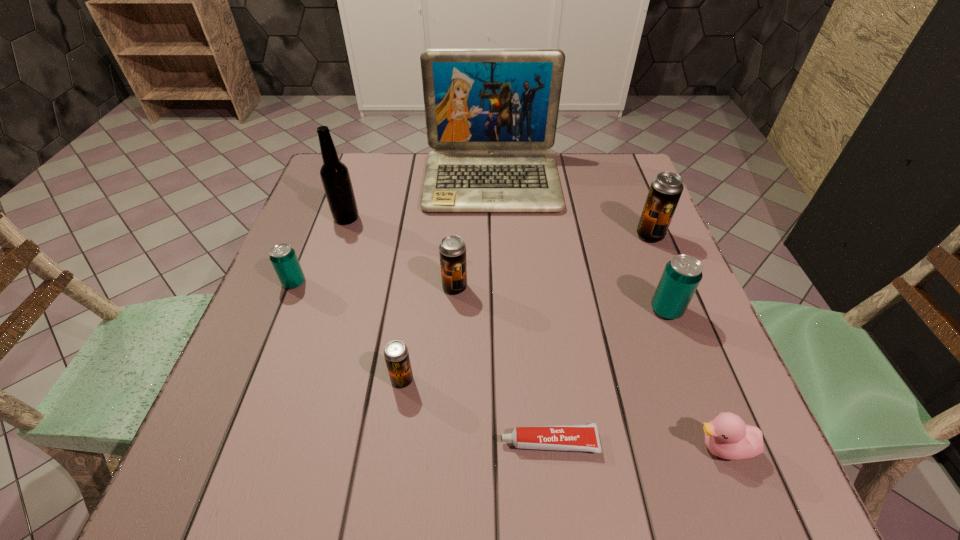
Where is `free region located on the back of the sixth farthest object`? free region located on the back of the sixth farthest object is located at coordinates (631, 216).

This screenshot has width=960, height=540. Find the location of `vacant space located on the back of the left teal beer can`. vacant space located on the back of the left teal beer can is located at coordinates (313, 237).

You are a GUI agent. You are given a task and a screenshot of the screen. Output one action in this format:
    pyautogui.click(x=<x>, y=<y>)
    Task: Click on the free space located on the left of the smallest black beer can
    This screenshot has width=960, height=540.
    Given the screenshot: What is the action you would take?
    pyautogui.click(x=260, y=380)

Where is `free space located on the front-facing side of the second shortest object`? free space located on the front-facing side of the second shortest object is located at coordinates (575, 448).

Identify the location of free location located 0.090m on the front-facing side of the second shortest object. The width and height of the screenshot is (960, 540). (636, 448).

Identify the location of vacant region located 0.280m on the front-facing side of the second shortest object. This screenshot has width=960, height=540. (520, 448).

Where is `vacant space located 0.390m at the nozzle of the shortest object`? vacant space located 0.390m at the nozzle of the shortest object is located at coordinates (264, 442).

The height and width of the screenshot is (540, 960). Find the location of `vacant space situated 0.190m at the nozzle of the shortest object`. vacant space situated 0.190m at the nozzle of the shortest object is located at coordinates (385, 442).

Where is `vacant space located at the nozzle of the shortest object`? The height and width of the screenshot is (540, 960). vacant space located at the nozzle of the shortest object is located at coordinates (264, 442).

The width and height of the screenshot is (960, 540). In order to click on object positioned at the far edge in this screenshot , I will do `click(491, 115)`.